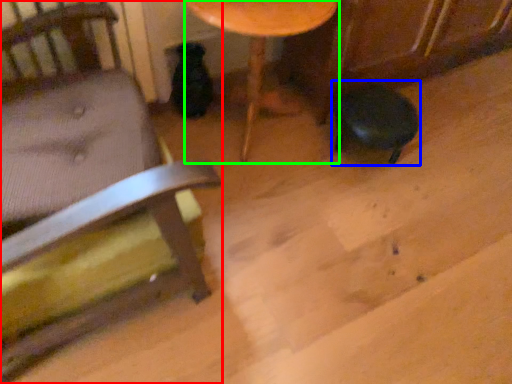
Question: Which object is the farthest from chair (highlighted by a red box)? Choose among these: bar stool (highlighted by a blue box) or table (highlighted by a green box).

Choices:
 (A) bar stool
 (B) table

Answer: (A)